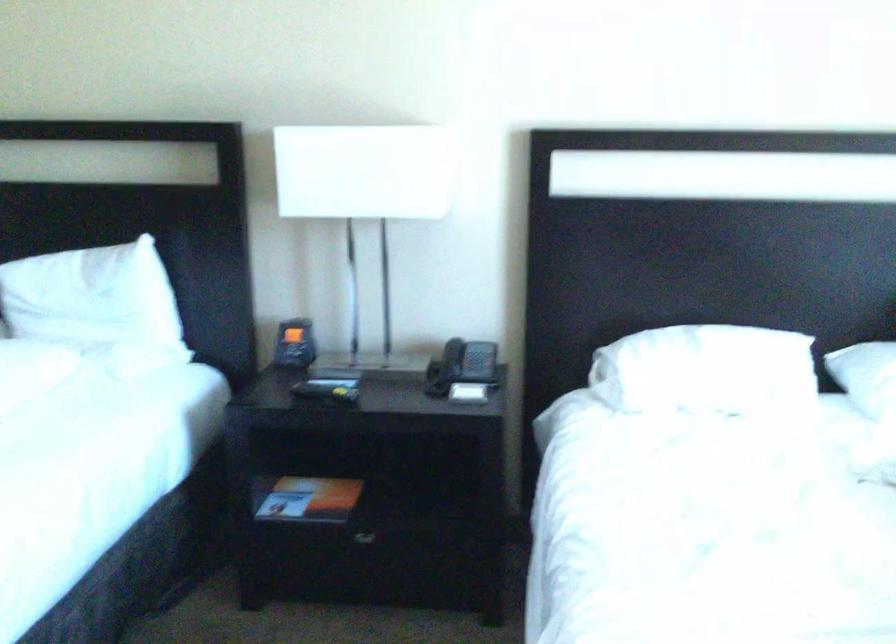
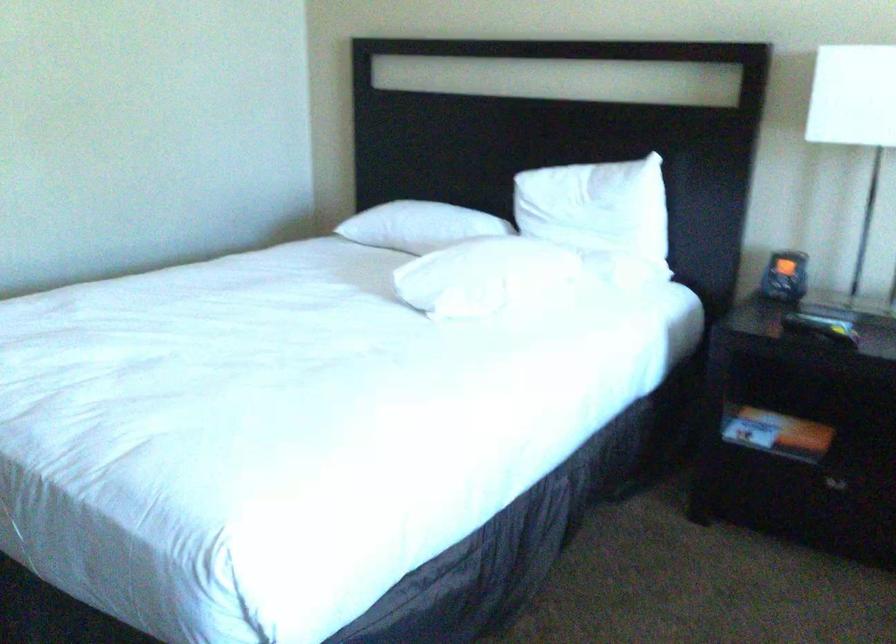
Locate, in the second image, the point that corresponds to point 101,297 in the first image.

(598, 209)